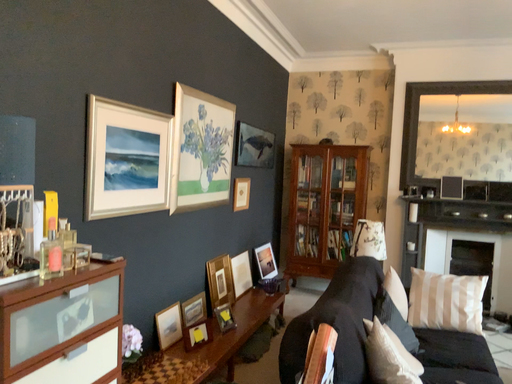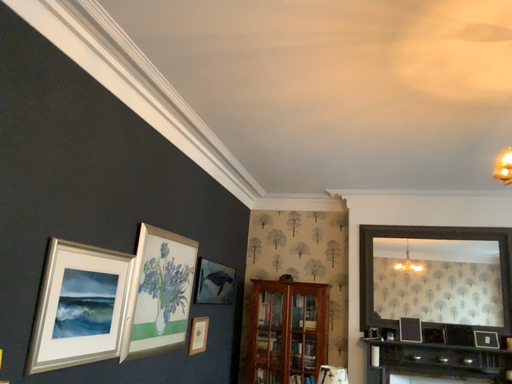
Question: How did the camera likely rotate when shooting the video?

Choices:
 (A) rotated downward
 (B) rotated upward

Answer: (B)